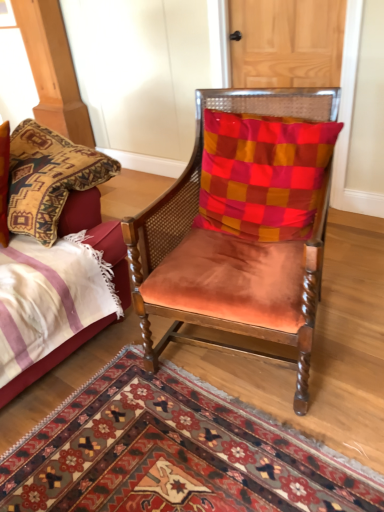
Question: Does suede orange chair at center touch carpet with intricate patterns at center?

Choices:
 (A) yes
 (B) no

Answer: (B)

Question: Can you confirm if suede orange chair at center is positioned to the left of carpet with intricate patterns at center?

Choices:
 (A) yes
 (B) no

Answer: (B)

Question: Can you confirm if suede orange chair at center is bigger than carpet with intricate patterns at center?

Choices:
 (A) no
 (B) yes

Answer: (B)

Question: Is suede orange chair at center positioned with its back to carpet with intricate patterns at center?

Choices:
 (A) no
 (B) yes

Answer: (A)

Question: From a real-world perspective, is suede orange chair at center under carpet with intricate patterns at center?

Choices:
 (A) no
 (B) yes

Answer: (A)

Question: Is suede orange chair at center taller or shorter than carpet with intricate patterns at center?

Choices:
 (A) short
 (B) tall

Answer: (B)

Question: Is suede orange chair at center in front of or behind carpet with intricate patterns at center in the image?

Choices:
 (A) front
 (B) behind

Answer: (B)

Question: Is suede orange chair at center wider or thinner than carpet with intricate patterns at center?

Choices:
 (A) wide
 (B) thin

Answer: (B)

Question: Based on their positions, is suede orange chair at center located to the left or right of carpet with intricate patterns at center?

Choices:
 (A) right
 (B) left

Answer: (A)

Question: From the image's perspective, is checkered fabric pillow at center positioned above or below wooden door at upper center?

Choices:
 (A) above
 (B) below

Answer: (B)

Question: Is point (279, 194) positioned closer to the camera than point (337, 56)?

Choices:
 (A) closer
 (B) farther

Answer: (A)

Question: Based on their positions, is checkered fabric pillow at center located to the left or right of wooden door at upper center?

Choices:
 (A) left
 (B) right

Answer: (A)

Question: Do you think checkered fabric pillow at center is within wooden door at upper center, or outside of it?

Choices:
 (A) outside
 (B) inside

Answer: (A)

Question: Would you say checkered fabric pillow at center is to the left or to the right of suede orange chair at center in the picture?

Choices:
 (A) left
 (B) right

Answer: (B)

Question: From the image's perspective, is checkered fabric pillow at center located above or below suede orange chair at center?

Choices:
 (A) below
 (B) above

Answer: (B)